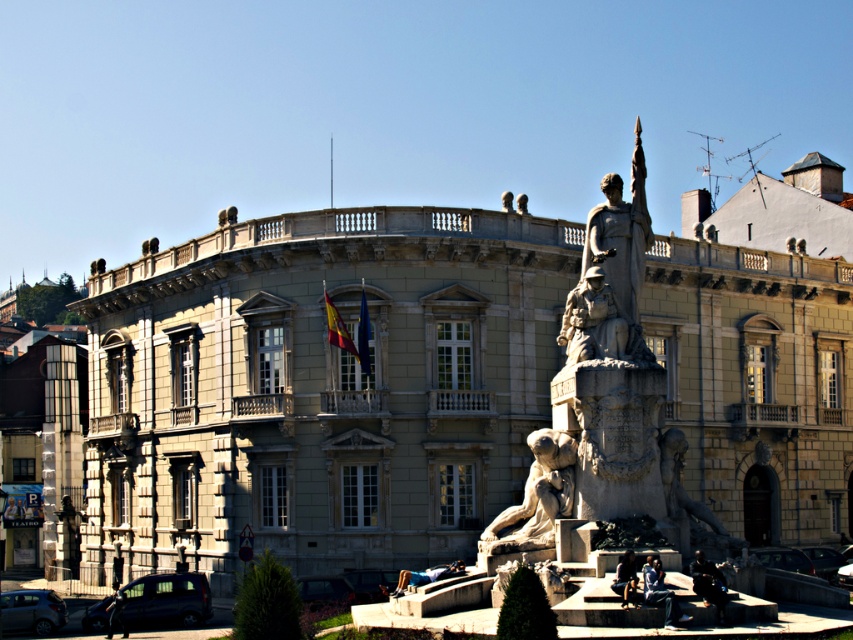
Question: Is stone statue at center positioned before stone lion at center?

Choices:
 (A) yes
 (B) no

Answer: (A)

Question: Which object is closer to the camera taking this photo?

Choices:
 (A) granite statue at center
 (B) stone statue at center
 (C) stone lion at center
 (D) stone building at center

Answer: (A)

Question: Does stone building at center have a lesser width compared to stone lion at center?

Choices:
 (A) no
 (B) yes

Answer: (A)

Question: Is stone building at center closer to the viewer compared to stone lion at center?

Choices:
 (A) yes
 (B) no

Answer: (A)

Question: Which point is farther to the camera?

Choices:
 (A) stone lion at center
 (B) stone statue at center

Answer: (A)

Question: Which of the following is the closest to the observer?

Choices:
 (A) stone statue at center
 (B) stone lion at center
 (C) stone building at center

Answer: (A)